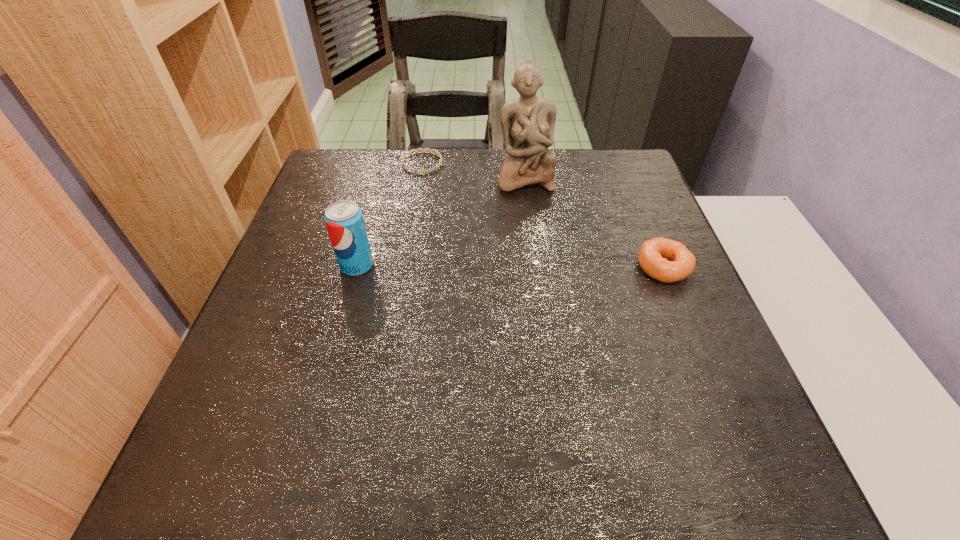
Locate an element on the screen. free space located 0.050m on the front-facing side of the figurine is located at coordinates (530, 207).

Identify the location of free space located 0.170m on the front-facing side of the figurine. (536, 238).

I want to click on free space located 0.220m on the front-facing side of the figurine, so click(539, 252).

In order to click on vacant area located 0.230m on the surface of the shortest object showing star-shaped elements in this screenshot , I will do `click(447, 224)`.

Where is `vacant area located on the surface of the shortest object showing star-shaped elements`? Image resolution: width=960 pixels, height=540 pixels. vacant area located on the surface of the shortest object showing star-shaped elements is located at coordinates (440, 205).

This screenshot has width=960, height=540. In order to click on vacant space located on the surface of the shortest object showing star-shaped elements in this screenshot , I will do (432, 187).

Where is `figurine located in the far edge section of the desktop`? The image size is (960, 540). figurine located in the far edge section of the desktop is located at coordinates (528, 122).

The image size is (960, 540). Find the location of `bracelet at the far edge`. bracelet at the far edge is located at coordinates (430, 151).

At what (x,y) coordinates should I click in order to perform the action: click on object located in the left edge section of the desktop. Please return your answer as a coordinate pair (x, y). Looking at the image, I should click on (344, 220).

Where is `object that is positioned at the right edge`? This screenshot has height=540, width=960. object that is positioned at the right edge is located at coordinates (652, 256).